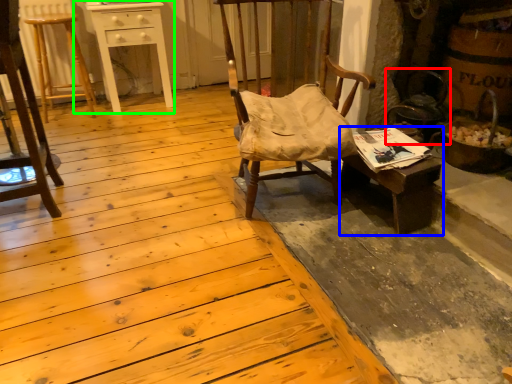
Question: Based on their relative distances, which object is nearer to swivel chair (highlighted by a red box)? Choose from desk (highlighted by a blue box) and table (highlighted by a green box).

Choices:
 (A) desk
 (B) table

Answer: (A)